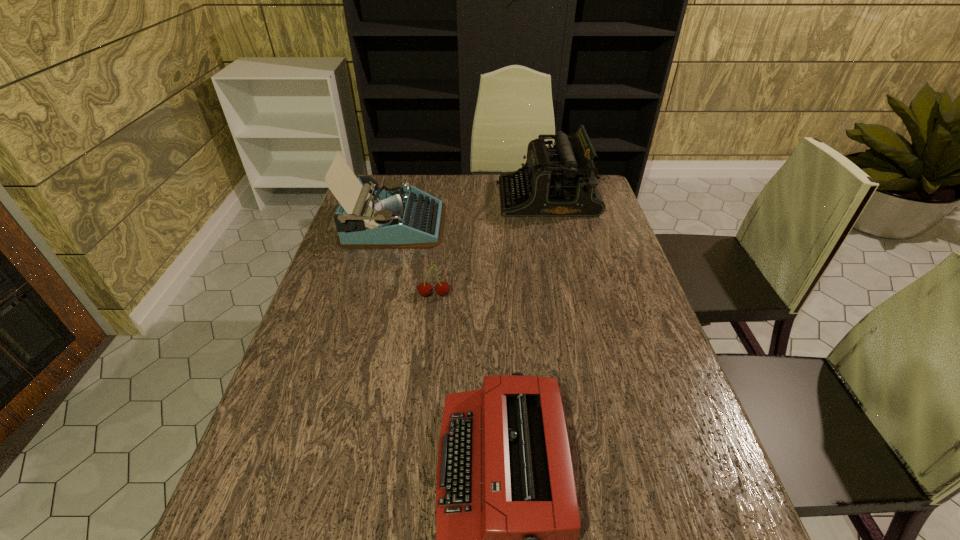
I want to click on the leftmost typewriter, so click(x=394, y=217).

You are a GUI agent. You are given a task and a screenshot of the screen. Output one action in this format:
    pyautogui.click(x=<x>, y=<y>)
    Task: Click on the cherry
    This screenshot has width=960, height=540.
    Given the screenshot: What is the action you would take?
    pyautogui.click(x=442, y=288)

Where is `free space located 0.400m on the typing side of the leftmost typewriter`? free space located 0.400m on the typing side of the leftmost typewriter is located at coordinates (567, 224).

The image size is (960, 540). Identify the location of blank space located 0.210m on the surface of the second nearest object. (426, 364).

Locate an element on the screen. Image resolution: width=960 pixels, height=540 pixels. object at the left edge is located at coordinates tap(394, 217).

This screenshot has width=960, height=540. Find the location of `object situated at the right edge`. object situated at the right edge is located at coordinates (561, 181).

This screenshot has height=540, width=960. Identify the location of object at the far left corner. (394, 217).

Image resolution: width=960 pixels, height=540 pixels. Identify the location of object situated at the far right corner. (561, 181).

In the image, there is a desktop. What are the coordinates of `vacant space at the far edge` in the screenshot? It's located at (478, 175).

Find the location of a particular element. vacant space at the left edge of the desktop is located at coordinates (333, 340).